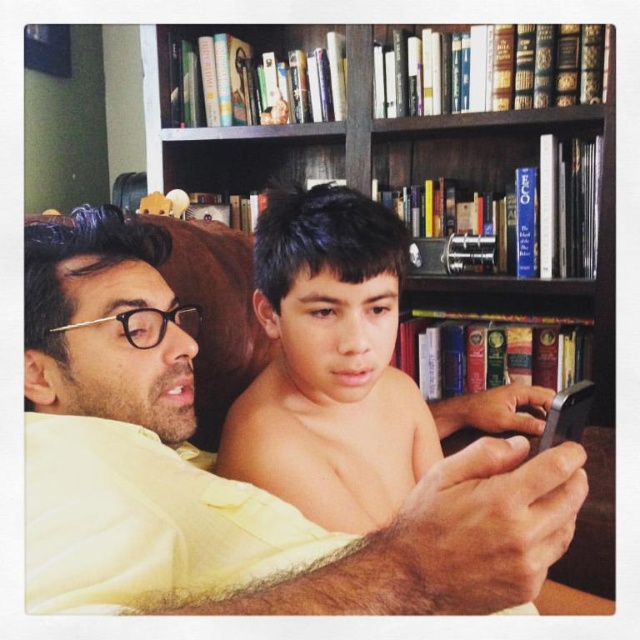
Does point (24, 419) come in front of point (285, 394)?

Yes, it is in front of point (285, 394).

Which is more to the right, matte yellow shirt at center or brown skin/smooth face at center?

brown skin/smooth face at center

Between point (566, 525) and point (300, 275), which one is positioned behind?

The point (300, 275) is more distant.

At what (x,y) coordinates should I click in order to perform the action: click on matte yellow shirt at center. Please return your answer as a coordinate pair (x, y). The height and width of the screenshot is (640, 640). Looking at the image, I should click on (227, 480).

Which of these two, matte yellow shirt at center or wooden bookshelf at upper center, stands shorter?

matte yellow shirt at center

Does matte yellow shirt at center appear on the left side of wooden bookshelf at upper center?

Correct, you'll find matte yellow shirt at center to the left of wooden bookshelf at upper center.

The height and width of the screenshot is (640, 640). What do you see at coordinates (227, 480) in the screenshot?
I see `matte yellow shirt at center` at bounding box center [227, 480].

Locate an element on the screen. The width and height of the screenshot is (640, 640). matte yellow shirt at center is located at coordinates (227, 480).

Between wooden bookshelf at upper center and brown skin/smooth face at center, which one has more height?

With more height is wooden bookshelf at upper center.

The image size is (640, 640). What do you see at coordinates (429, 164) in the screenshot?
I see `wooden bookshelf at upper center` at bounding box center [429, 164].

Which is behind, point (296, 38) or point (301, 429)?

The point (296, 38) is behind.

The width and height of the screenshot is (640, 640). In order to click on wooden bookshelf at upper center in this screenshot , I will do `click(429, 164)`.